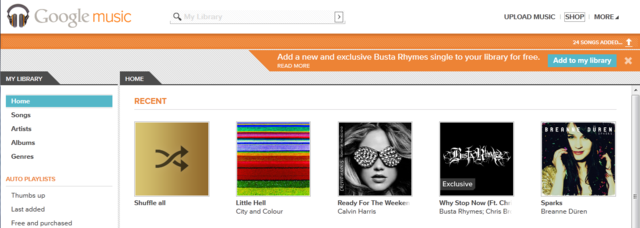
The image size is (640, 228). What are the coordinates of `exit icon` in the screenshot? It's located at (626, 60).